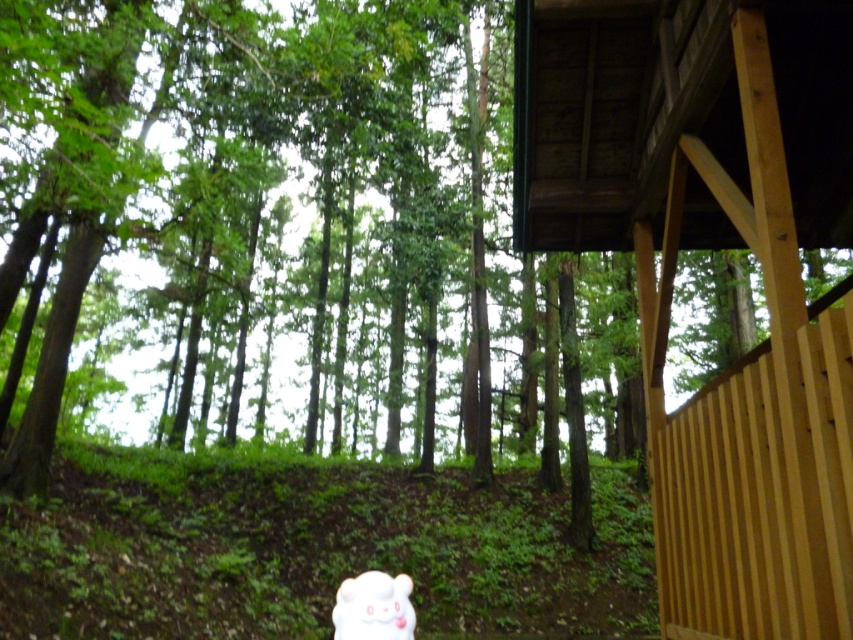
Who is shorter, wooden cabin at upper right or white plush toy at lower center?

white plush toy at lower center is shorter.

Which is in front, point (572, 189) or point (352, 579)?

Point (352, 579) is in front.

I want to click on wooden cabin at upper right, so click(712, 248).

Where is `wooden cabin at upper right`? This screenshot has width=853, height=640. wooden cabin at upper right is located at coordinates (712, 248).